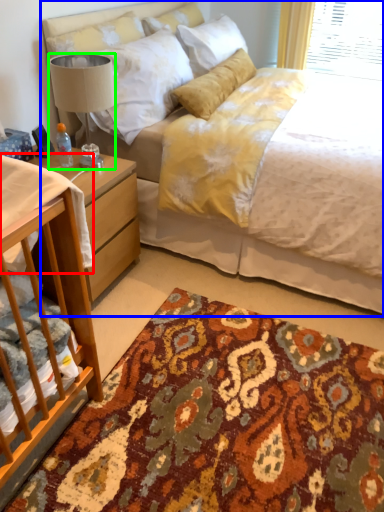
Question: Considering the real-world distances, which object is farthest from sheet (highlighted by a red box)? bed (highlighted by a blue box) or lamp (highlighted by a green box)?

Choices:
 (A) bed
 (B) lamp

Answer: (A)